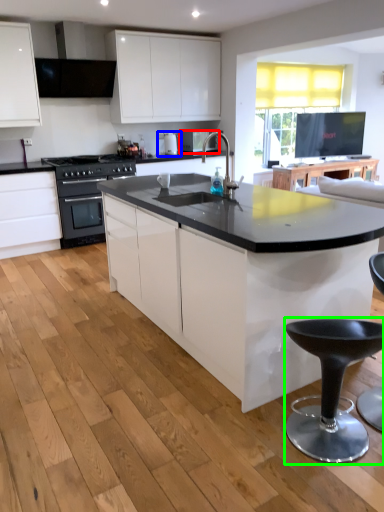
Question: Estimate the real-world distances between objects in this image. Which object is farther from appliance (highlighted by a red box), coffee machine (highlighted by a blue box) or bar stool (highlighted by a green box)?

Choices:
 (A) coffee machine
 (B) bar stool

Answer: (B)